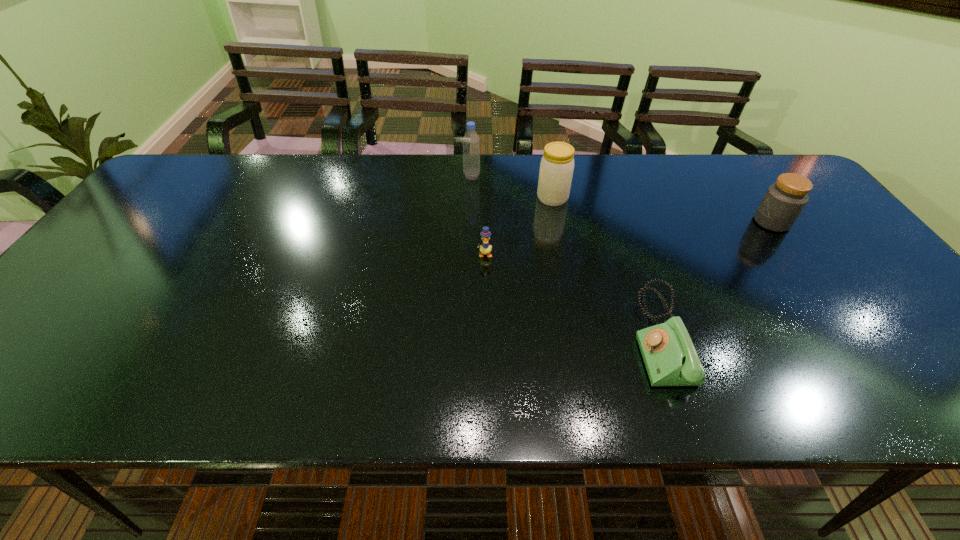
Find the location of a particular element. This screenshot has width=960, height=540. bottle is located at coordinates (471, 143).

The width and height of the screenshot is (960, 540). I want to click on the third object from right to left, so click(x=557, y=164).

Locate an element on the screen. Image resolution: width=960 pixels, height=540 pixels. the farther jar is located at coordinates (557, 164).

Locate an element on the screen. the nearer jar is located at coordinates (784, 200).

You are a GUI agent. You are given a task and a screenshot of the screen. Output one action in this format:
    pyautogui.click(x=<x>, y=<y>)
    Task: Click on the right jar
    This screenshot has height=540, width=960.
    Given the screenshot: What is the action you would take?
    pyautogui.click(x=784, y=200)

The height and width of the screenshot is (540, 960). I want to click on duckling, so click(x=485, y=248).

You are a GUI agent. You are given a task and a screenshot of the screen. Output one action in this format:
    pyautogui.click(x=<x>, y=<y>)
    Task: Click on the nearest object
    The width and height of the screenshot is (960, 540).
    Given the screenshot: What is the action you would take?
    pyautogui.click(x=670, y=358)

Find the location of `telephone`. telephone is located at coordinates (670, 358).

Find the location of a particular element. vacant space located 0.240m on the left of the bottle is located at coordinates (387, 176).

Identify the location of vacant space located on the front of the left jar. (572, 300).